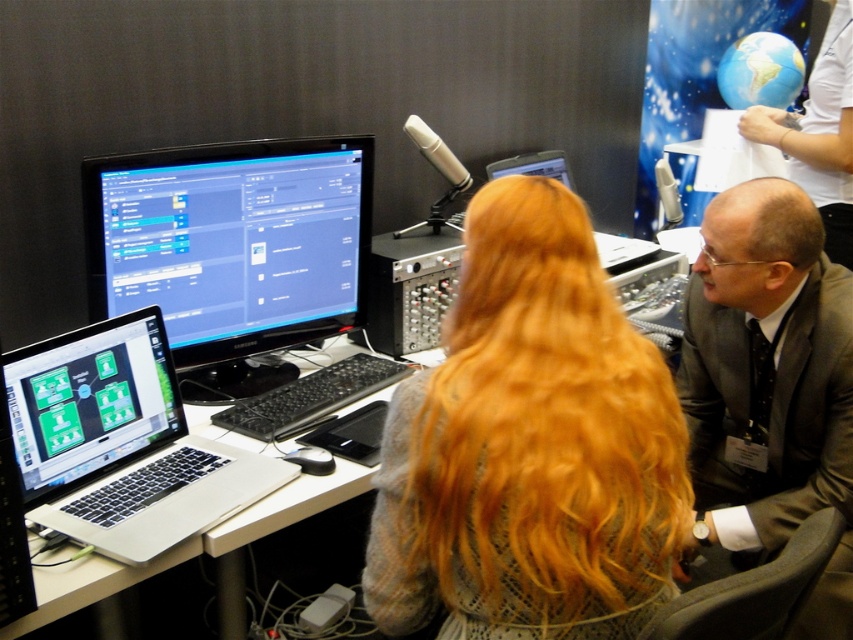
You are standing in front of the desk in the control room and notice two points marked on the monitor. The first point is at coordinates point (177, 250) and the second is at point (845, 380). Which point is closer to you?

Point (177, 250) is further to the camera than point (845, 380), so the second point is closer to you.

You are an office worker who needs to access both the matte black monitor at center and the matte black laptop at left. Since you are seated to the left of the desk, which device is closer to your right hand?

The matte black monitor at center is positioned on the right side of the matte black laptop at left. Since you are seated to the left of the desk, the matte black monitor at center would be closer to your right hand.